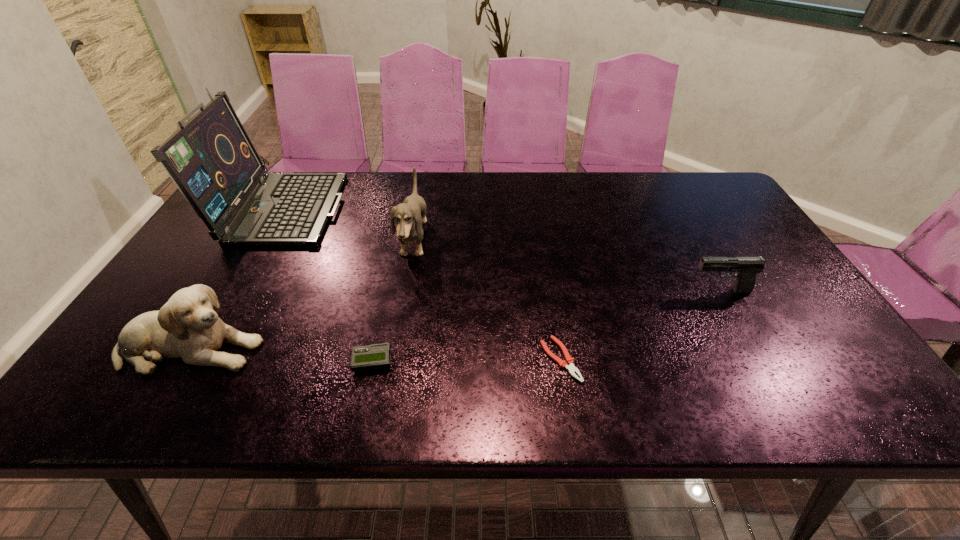
Locate an element on the screen. The width and height of the screenshot is (960, 540). object that is the second nearest to the beeper is located at coordinates (409, 215).

Where is `object that is the third closest one to the fifth tallest object`? The width and height of the screenshot is (960, 540). object that is the third closest one to the fifth tallest object is located at coordinates (569, 363).

Where is `free spot that satisfies the following two spatial constraints: 1. on the front-facing side of the tallest object; 2. on the back side of the fifth object from left to right`? The height and width of the screenshot is (540, 960). free spot that satisfies the following two spatial constraints: 1. on the front-facing side of the tallest object; 2. on the back side of the fifth object from left to right is located at coordinates (197, 360).

Locate an element on the screen. This screenshot has height=540, width=960. free location that satisfies the following two spatial constraints: 1. on the front-facing side of the nearer puppy; 2. on the back side of the beeper is located at coordinates (182, 361).